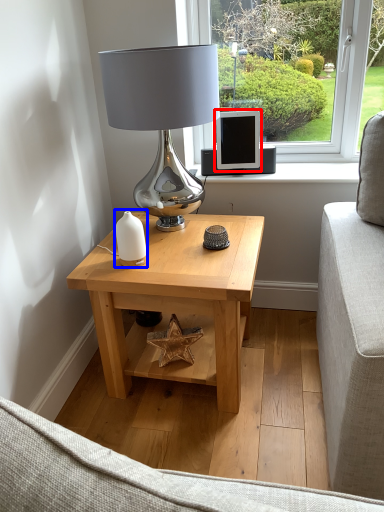
Question: Which of the following is the closest to the observer, computer monitor (highlighted by a red box) or candle holder (highlighted by a blue box)?

Choices:
 (A) computer monitor
 (B) candle holder

Answer: (B)